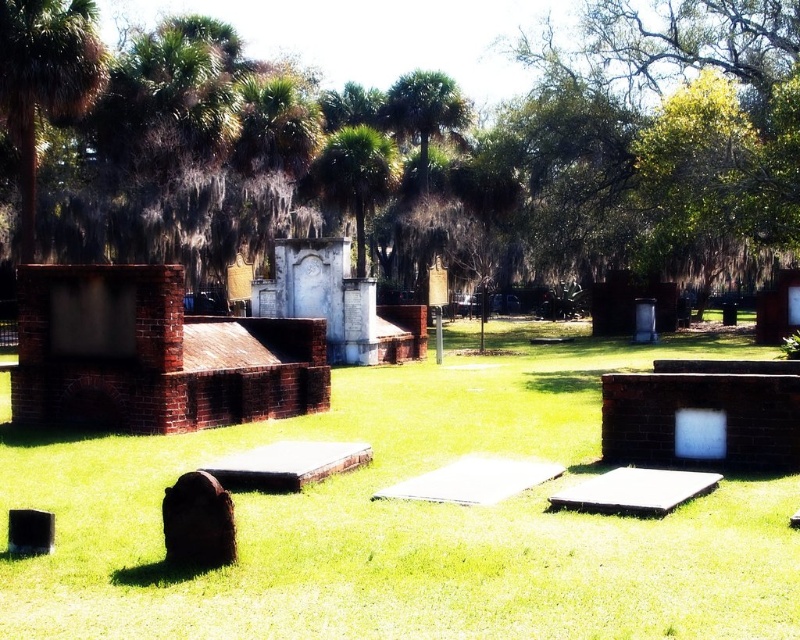
Question: Among these points, which one is farthest from the camera?

Choices:
 (A) (380, 157)
 (B) (698, 8)
 (C) (176, 545)

Answer: (A)

Question: Based on their relative distances, which object is farther from the green leafy tree at upper center?

Choices:
 (A) dark brown stone gravestone at lower left
 (B) green leafy palm tree at center

Answer: (A)

Question: Can you confirm if green leafy tree at upper center is positioned below green leafy palm tree at center?

Choices:
 (A) yes
 (B) no

Answer: (B)

Question: Is green leafy palm tree at center smaller than dark brown stone gravestone at lower left?

Choices:
 (A) no
 (B) yes

Answer: (A)

Question: Which object is positioned closest to the dark brown stone gravestone at lower left?

Choices:
 (A) green leafy palm tree at center
 (B) green leafy tree at upper center
 (C) green grass at center

Answer: (C)

Question: Does green leafy tree at upper center come behind green grass at center?

Choices:
 (A) no
 (B) yes

Answer: (B)